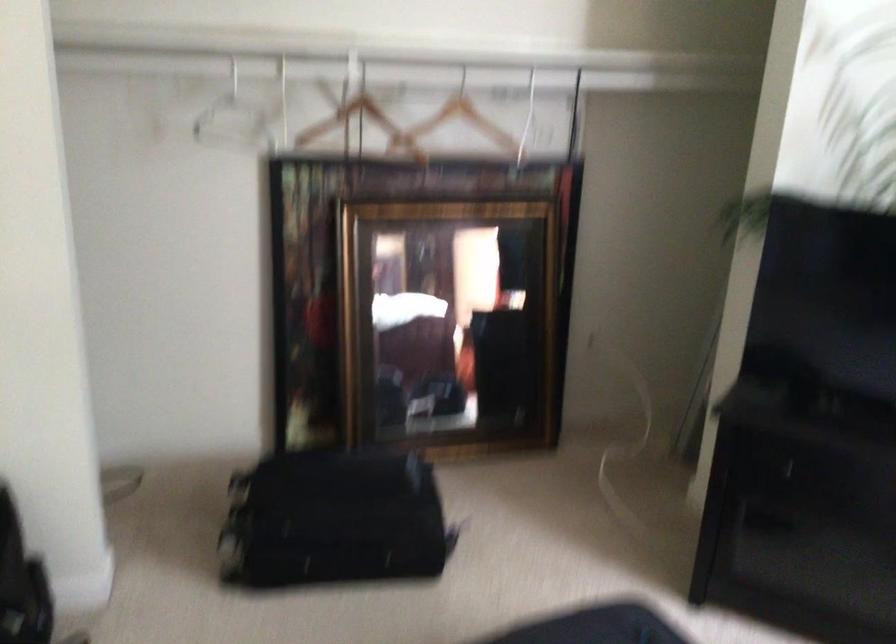
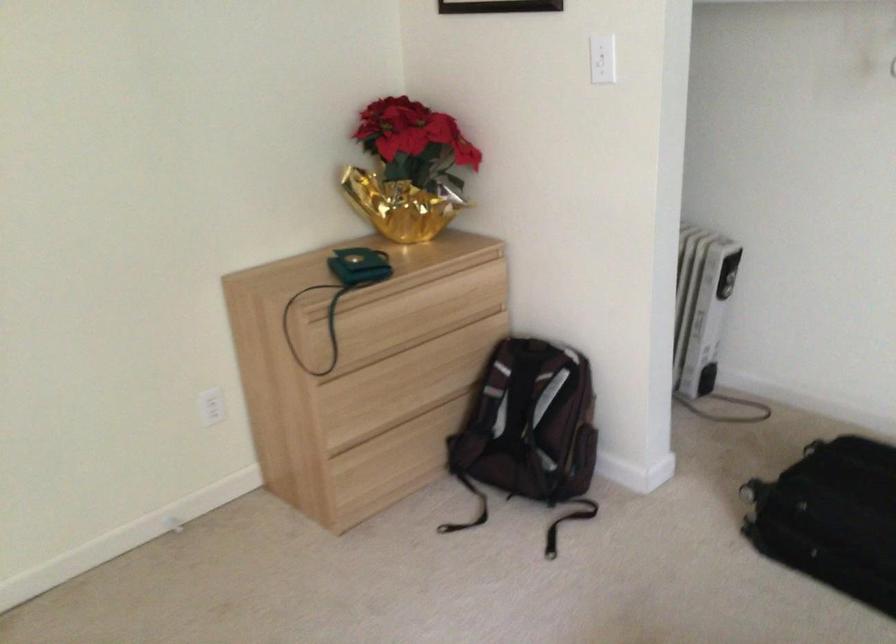
Question: The first image is from the beginning of the video and the second image is from the end. How did the camera likely rotate when shooting the video?

Choices:
 (A) Left
 (B) Right
 (C) Up
 (D) Down

Answer: (A)